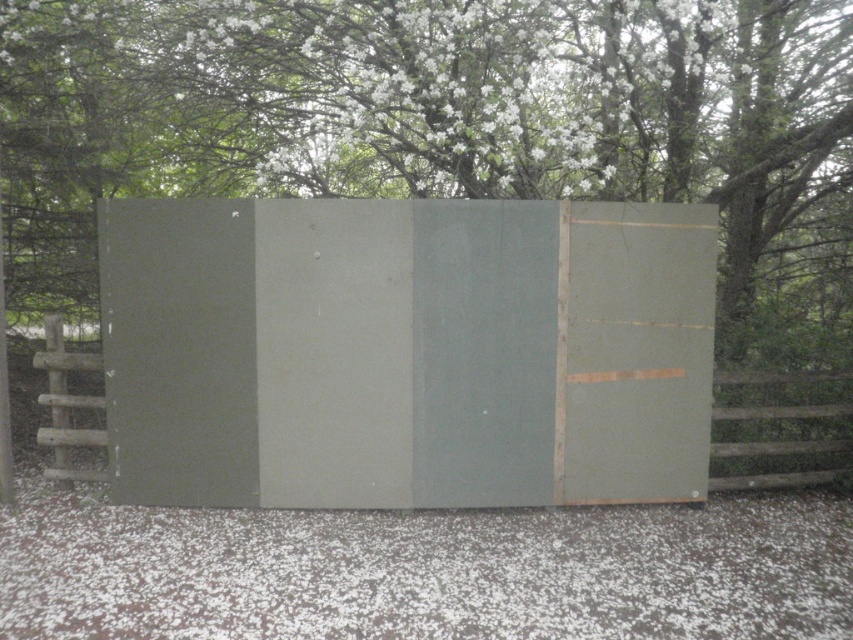
Question: Considering the relative positions of matte green panel at center and white fluffy snow at lower center in the image provided, where is matte green panel at center located with respect to white fluffy snow at lower center?

Choices:
 (A) below
 (B) above

Answer: (B)

Question: Where is green matte wall at upper center located in relation to wooden fence at left in the image?

Choices:
 (A) above
 (B) below

Answer: (A)

Question: Is white fluffy snow at lower center bigger than wooden fence at left?

Choices:
 (A) no
 (B) yes

Answer: (A)

Question: Among these points, which one is nearest to the camera?

Choices:
 (A) (190, 577)
 (B) (410, 49)
 (C) (824, 451)

Answer: (A)

Question: Which object appears farthest from the camera in this image?

Choices:
 (A) green matte wall at upper center
 (B) brown wooden fence at right
 (C) wooden fence at left

Answer: (A)

Question: Which of the following is the farthest from the observer?

Choices:
 (A) wooden fence at left
 (B) matte green panel at center

Answer: (A)